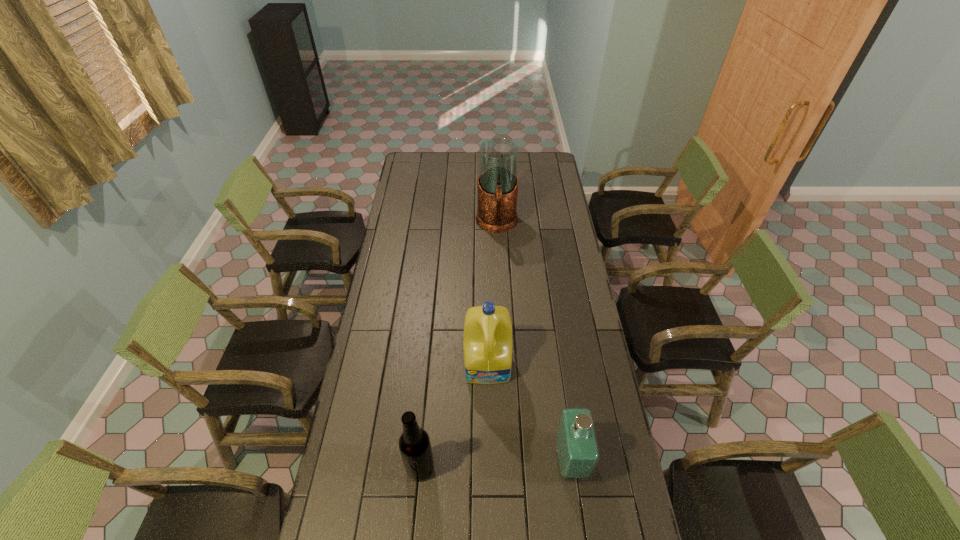
The width and height of the screenshot is (960, 540). In order to click on the leftmost object in this screenshot , I will do `click(415, 448)`.

At what (x,y) coordinates should I click in order to perform the action: click on the shortest object. Please return your answer as a coordinate pair (x, y). This screenshot has height=540, width=960. Looking at the image, I should click on click(577, 453).

What are the coordinates of `perfume` in the screenshot? It's located at (577, 453).

Image resolution: width=960 pixels, height=540 pixels. Identify the location of the farthest object. (498, 157).

This screenshot has width=960, height=540. Identify the location of pitcher. (498, 157).

At what (x,y) coordinates should I click in order to perform the action: click on the third nearest object. Please return your answer as a coordinate pair (x, y). The width and height of the screenshot is (960, 540). Looking at the image, I should click on (487, 344).

You are a GUI agent. You are given a task and a screenshot of the screen. Output one action in this format:
    pyautogui.click(x=<x>, y=<y>)
    Task: Click on the free space located 0.120m on the right of the leftmost object
    
    Given the screenshot: What is the action you would take?
    pyautogui.click(x=472, y=468)

This screenshot has height=540, width=960. I want to click on free point located 0.120m on the front label of the rightmost object, so click(623, 461).

Identify the location of free space located with the handle on the side of the pitcher. The width and height of the screenshot is (960, 540). (499, 288).

This screenshot has height=540, width=960. I want to click on vacant area located with the handle on the side of the pitcher, so click(x=498, y=267).